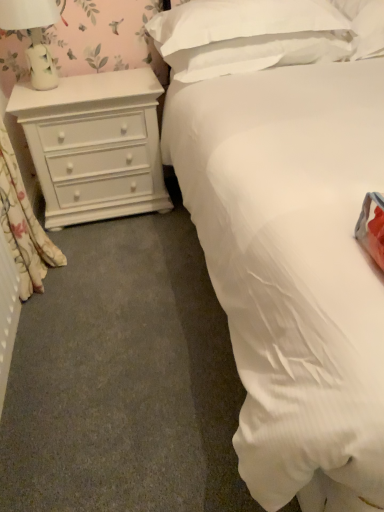
How much space does white soft pillow at upper center, acting as the 2th pillow starting from the left, occupy horizontally?

white soft pillow at upper center, acting as the 2th pillow starting from the left, is 19.16 inches in width.

This screenshot has width=384, height=512. What do you see at coordinates (248, 36) in the screenshot?
I see `white soft pillow at upper center, positioned as the first pillow in left-to-right order` at bounding box center [248, 36].

This screenshot has width=384, height=512. I want to click on floral fabric curtain at left, so click(x=23, y=225).

Considering the relative sizes of white matte chest of drawers at left and white ceramic lamp at upper left in the image provided, is white matte chest of drawers at left thinner than white ceramic lamp at upper left?

No, white matte chest of drawers at left is not thinner than white ceramic lamp at upper left.

Is white matte chest of drawers at left aimed at white ceramic lamp at upper left?

No, white matte chest of drawers at left is not oriented towards white ceramic lamp at upper left.

The height and width of the screenshot is (512, 384). I want to click on lamp in front of the white matte chest of drawers at left, so click(33, 35).

From the image's perspective, would you say white matte chest of drawers at left is shown under white ceramic lamp at upper left?

Yes, from the image's perspective, white matte chest of drawers at left is beneath white ceramic lamp at upper left.

In terms of height, does white soft pillow at upper center, marked as the 2th pillow in a right-to-left arrangement, look taller or shorter compared to white ceramic lamp at upper left?

Clearly, white soft pillow at upper center, marked as the 2th pillow in a right-to-left arrangement, is shorter compared to white ceramic lamp at upper left.

Is white ceramic lamp at upper left completely or partially inside white soft pillow at upper center, marked as the 2th pillow in a right-to-left arrangement?

No, white ceramic lamp at upper left is not inside white soft pillow at upper center, marked as the 2th pillow in a right-to-left arrangement.

Looking at the image, does white soft pillow at upper center, marked as the 2th pillow in a right-to-left arrangement, seem bigger or smaller compared to white ceramic lamp at upper left?

In the image, white soft pillow at upper center, marked as the 2th pillow in a right-to-left arrangement, appears to be larger than white ceramic lamp at upper left.

Is white matte chest of drawers at left facing away from floral fabric curtain at left?

That's not correct — white matte chest of drawers at left is not looking away from floral fabric curtain at left.

Is white matte chest of drawers at left positioned behind floral fabric curtain at left?

Yes, the depth of white matte chest of drawers at left is greater than that of floral fabric curtain at left.

From a real-world perspective, between white matte chest of drawers at left and floral fabric curtain at left, who is vertically higher?

In real-world perspective, floral fabric curtain at left is above.

Would you say white matte chest of drawers at left is to the left or to the right of floral fabric curtain at left in the picture?

white matte chest of drawers at left is to the right of floral fabric curtain at left.

From the image's perspective, between white soft pillow at upper center, the first pillow from the right, and floral fabric curtain at left, who is located below?

floral fabric curtain at left is shown below in the image.

I want to click on curtain that appears below the white soft pillow at upper center, acting as the 2th pillow starting from the left (from the image's perspective), so click(23, 225).

Is white soft pillow at upper center, the first pillow from the right, to the right of floral fabric curtain at left from the viewer's perspective?

Correct, you'll find white soft pillow at upper center, the first pillow from the right, to the right of floral fabric curtain at left.

Which of these two, white soft pillow at upper center, marked as the 2th pillow in a right-to-left arrangement, or floral fabric curtain at left, is bigger?

white soft pillow at upper center, marked as the 2th pillow in a right-to-left arrangement, is bigger.

What's the angular difference between white soft pillow at upper center, marked as the 2th pillow in a right-to-left arrangement, and floral fabric curtain at left's facing directions?

The angle between the facing direction of white soft pillow at upper center, marked as the 2th pillow in a right-to-left arrangement, and the facing direction of floral fabric curtain at left is 86.6 degrees.

From a real-world perspective, does white soft pillow at upper center, positioned as the first pillow in left-to-right order, sit lower than floral fabric curtain at left?

Incorrect, from a real-world perspective, white soft pillow at upper center, positioned as the first pillow in left-to-right order, is higher than floral fabric curtain at left.

Looking at their sizes, would you say white soft pillow at upper center, marked as the 2th pillow in a right-to-left arrangement, is wider or thinner than floral fabric curtain at left?

Clearly, white soft pillow at upper center, marked as the 2th pillow in a right-to-left arrangement, has more width compared to floral fabric curtain at left.

From a real-world perspective, which is physically above, white soft pillow at upper center, acting as the 2th pillow starting from the left, or white soft pillow at upper center, positioned as the first pillow in left-to-right order?

From a 3D spatial view, white soft pillow at upper center, positioned as the first pillow in left-to-right order, is above.

Does white soft pillow at upper center, acting as the 2th pillow starting from the left, have a greater height compared to white soft pillow at upper center, marked as the 2th pillow in a right-to-left arrangement?

Answer: No, white soft pillow at upper center, acting as the 2th pillow starting from the left, is not taller than white soft pillow at upper center, marked as the 2th pillow in a right-to-left arrangement.

Which point is more distant from viewer, (362, 11) or (240, 38)?

Positioned behind is point (362, 11).

Is white matte chest of drawers at left inside or outside of white soft pillow at upper center, the first pillow from the right?

white matte chest of drawers at left cannot be found inside white soft pillow at upper center, the first pillow from the right.

Where is `chest of drawers on the left of white soft pillow at upper center, the first pillow from the right`? This screenshot has height=512, width=384. chest of drawers on the left of white soft pillow at upper center, the first pillow from the right is located at coordinates (95, 145).

In terms of width, does white matte chest of drawers at left look wider or thinner when compared to white soft pillow at upper center, the first pillow from the right?

In the image, white matte chest of drawers at left appears to be more narrow than white soft pillow at upper center, the first pillow from the right.

From a real-world perspective, which is physically below, white matte chest of drawers at left or white soft pillow at upper center, the first pillow from the right?

From a 3D spatial view, white matte chest of drawers at left is below.

Locate an element on the screen. The image size is (384, 512). lamp above the white matte chest of drawers at left (from the image's perspective) is located at coordinates (33, 35).

Image resolution: width=384 pixels, height=512 pixels. Identify the location of lamp below the white soft pillow at upper center, marked as the 2th pillow in a right-to-left arrangement (from the image's perspective). (33, 35).

Estimate the real-world distances between objects in this image. Which object is further from floral fabric curtain at left, white ceramic lamp at upper left or white soft pillow at upper center, marked as the 2th pillow in a right-to-left arrangement?

Based on the image, white soft pillow at upper center, marked as the 2th pillow in a right-to-left arrangement, appears to be further to floral fabric curtain at left.

When comparing their distances from white matte chest of drawers at left, does floral fabric curtain at left or white soft pillow at upper center, the first pillow from the right, seem further?

white soft pillow at upper center, the first pillow from the right.

From the picture: Looking at the image, which one is located further to white soft pillow at upper center, the first pillow from the right, white soft pillow at upper center, positioned as the first pillow in left-to-right order, or white ceramic lamp at upper left?

The object further to white soft pillow at upper center, the first pillow from the right, is white ceramic lamp at upper left.

From the image, which object appears to be nearer to white soft pillow at upper center, marked as the 2th pillow in a right-to-left arrangement, white soft pillow at upper center, the first pillow from the right, or white ceramic lamp at upper left?

white soft pillow at upper center, the first pillow from the right, lies closer to white soft pillow at upper center, marked as the 2th pillow in a right-to-left arrangement, than the other object.

Estimate the real-world distances between objects in this image. Which object is closer to white soft pillow at upper center, the first pillow from the right, white ceramic lamp at upper left or floral fabric curtain at left?

white ceramic lamp at upper left is closer to white soft pillow at upper center, the first pillow from the right.

From the image, which object appears to be farther from white matte chest of drawers at left, white soft pillow at upper center, marked as the 2th pillow in a right-to-left arrangement, or white soft pillow at upper center, acting as the 2th pillow starting from the left?

The object further to white matte chest of drawers at left is white soft pillow at upper center, acting as the 2th pillow starting from the left.

Estimate the real-world distances between objects in this image. Which object is further from white soft pillow at upper center, marked as the 2th pillow in a right-to-left arrangement, white soft pillow at upper center, acting as the 2th pillow starting from the left, or white matte chest of drawers at left?

white matte chest of drawers at left.

From the image, which object appears to be farther from floral fabric curtain at left, white soft pillow at upper center, positioned as the first pillow in left-to-right order, or white ceramic lamp at upper left?

Among the two, white soft pillow at upper center, positioned as the first pillow in left-to-right order, is located further to floral fabric curtain at left.

Identify the location of chest of drawers between white ceramic lamp at upper left and white soft pillow at upper center, the first pillow from the right, in the horizontal direction. This screenshot has height=512, width=384. (95, 145).

Identify the location of curtain situated between white ceramic lamp at upper left and white soft pillow at upper center, the first pillow from the right, from left to right. (23, 225).

You are a GUI agent. You are given a task and a screenshot of the screen. Output one action in this format:
    pyautogui.click(x=<x>, y=<y>)
    Task: Click on the lamp located between floral fabric curtain at left and white matte chest of drawers at left in the depth direction
    The width and height of the screenshot is (384, 512).
    Given the screenshot: What is the action you would take?
    pyautogui.click(x=33, y=35)

Where is `chest of drawers between floral fabric curtain at left and white soft pillow at upper center, marked as the 2th pillow in a right-to-left arrangement, from left to right`? The image size is (384, 512). chest of drawers between floral fabric curtain at left and white soft pillow at upper center, marked as the 2th pillow in a right-to-left arrangement, from left to right is located at coordinates (95, 145).